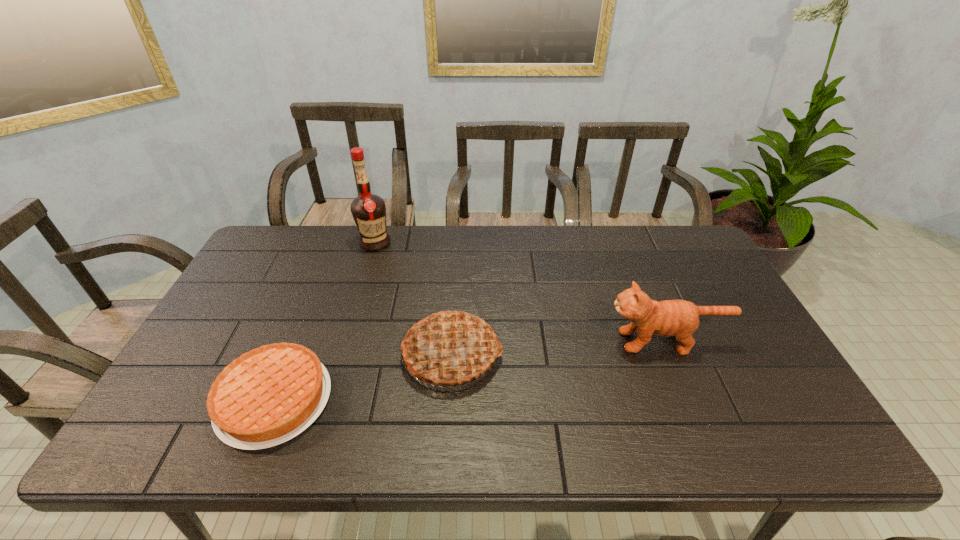
The height and width of the screenshot is (540, 960). I want to click on the tallest object, so click(x=368, y=210).

The image size is (960, 540). I want to click on liquor, so click(x=368, y=210).

You are a GUI agent. You are given a task and a screenshot of the screen. Output one action in this format:
    pyautogui.click(x=<x>, y=<y>)
    Task: Click on the rightmost object
    
    Given the screenshot: What is the action you would take?
    pyautogui.click(x=679, y=318)

I want to click on the second object from right to left, so click(450, 349).

Where is `the right pie`? the right pie is located at coordinates (450, 349).

Find the location of a particular element. the left pie is located at coordinates (267, 396).

Locate an element on the screen. This screenshot has width=960, height=540. the shorter pie is located at coordinates (267, 396).

Locate an element on the screen. vacant space located on the front and back of the liquor is located at coordinates pos(355,308).

This screenshot has width=960, height=540. In order to click on vacant position located on the face of the cat in this screenshot , I will do `click(564, 341)`.

Find the location of `free space located 0.310m on the face of the cat`. free space located 0.310m on the face of the cat is located at coordinates (491, 341).